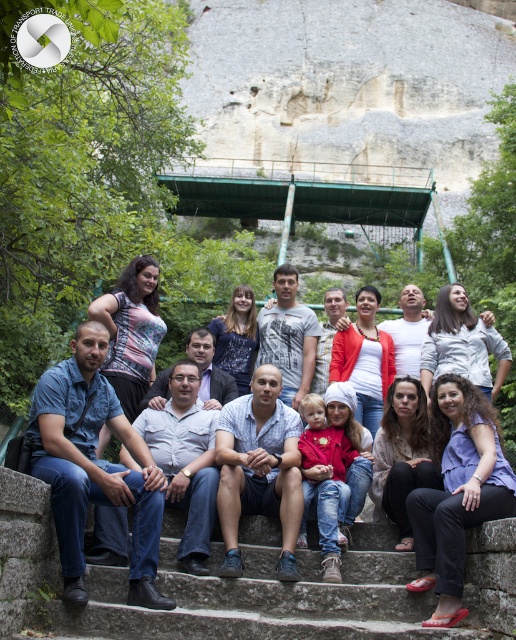
Does gray concrete stairs at lower center have a greater width compared to light blue denim jeans at center?

Incorrect, gray concrete stairs at lower center's width does not surpass light blue denim jeans at center's.

Can you confirm if gray concrete stairs at lower center is taller than light blue denim jeans at center?

No.

Between point (407, 637) and point (250, 522), which one is positioned in front?

Point (407, 637)

Where is `gray concrete stairs at lower center`? The image size is (516, 640). gray concrete stairs at lower center is located at coordinates (295, 593).